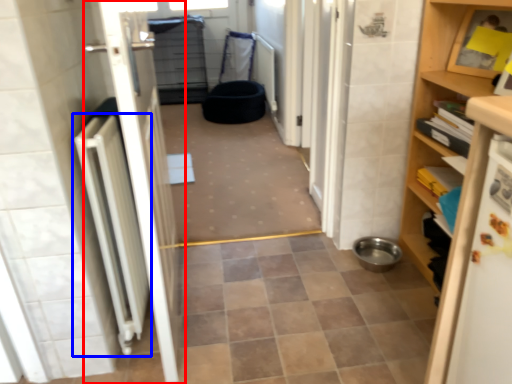
Question: Which point is closer to the camera, door (highlighted by a red box) or radiator (highlighted by a blue box)?

Choices:
 (A) door
 (B) radiator

Answer: (A)